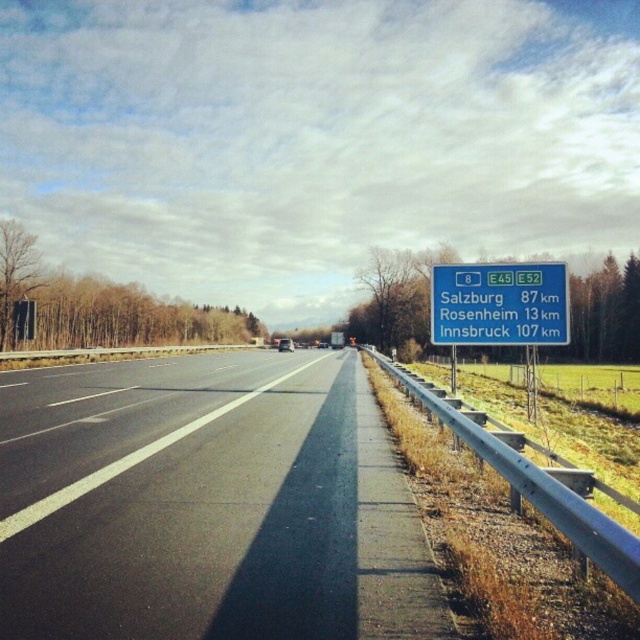
Is black asphalt highway at center closer to camera compared to green plastic sign at right?

Yes, black asphalt highway at center is in front of green plastic sign at right.

Is the position of black asphalt highway at center more distant than that of green plastic sign at right?

That is False.

Is point (353, 484) closer to camera compared to point (548, 266)?

Yes, point (353, 484) is closer to viewer.

Image resolution: width=640 pixels, height=640 pixels. What are the coordinates of `black asphalt highway at center` in the screenshot? It's located at (234, 529).